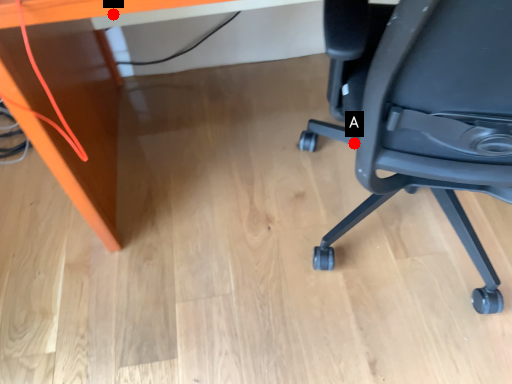
Question: Two points are circled on the image, labeled by A and B beside each circle. Which point is farther from the camera taking this photo?

Choices:
 (A) A is further
 (B) B is further

Answer: (B)